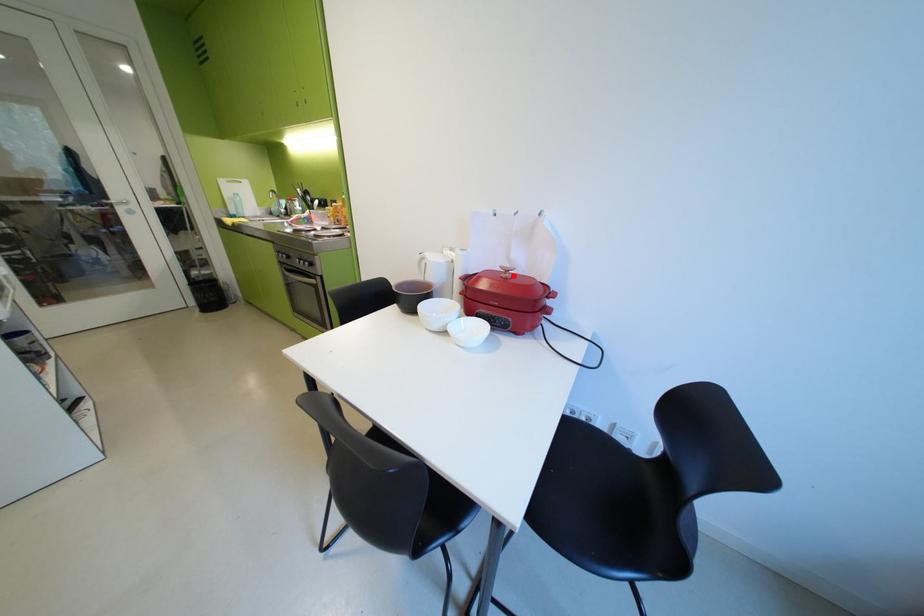
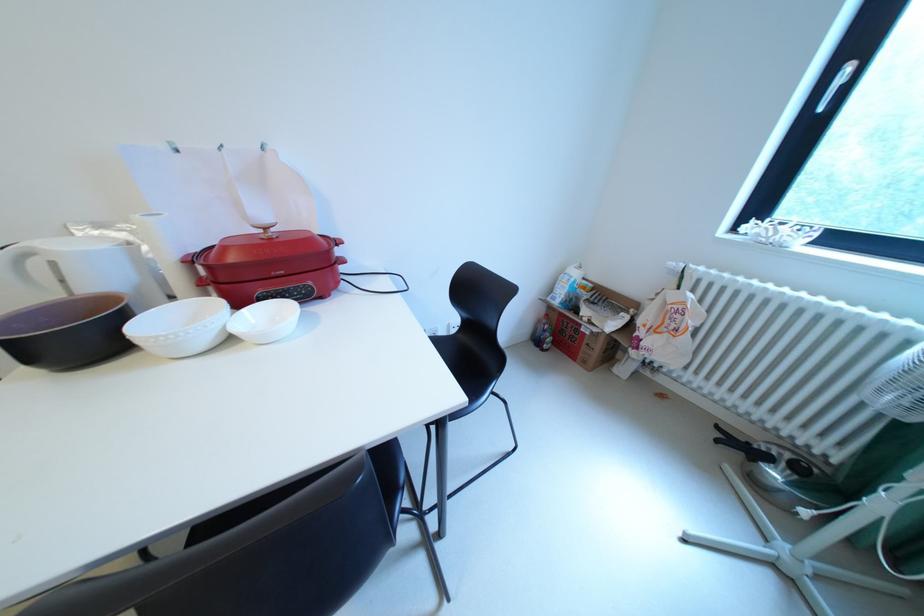
Find the pixel in the second image that matches the highlighted location in the first image.

(273, 237)